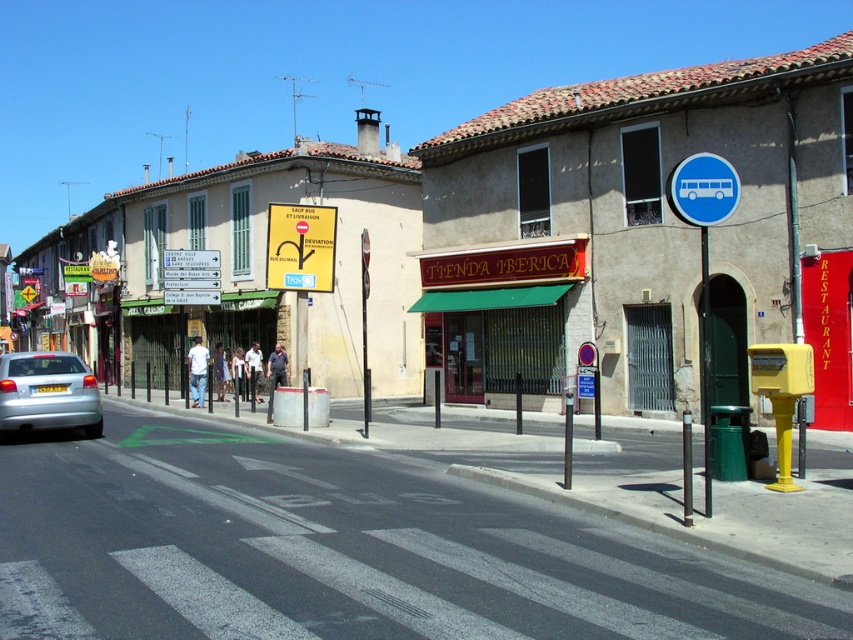
You are a tourist in this town and want to take the bus to the next village. You see the blue plastic bus at upper right and the yellow plastic sign at upper center. Which direction should you walk to reach the bus from the sign?

You should walk to the right to reach the blue plastic bus at upper right from the yellow plastic sign at upper center because the blue plastic bus at upper right is located to the right of the yellow plastic sign at upper center.

You are a delivery person carrying a large package that is 1 meter wide. You need to pass through the space between the green awning at center and the light blue denim jeans at center. Can your package fit through the space between them?

The green awning at center is wider than the light blue denim jeans at center. However, the description only provides their individual widths, not the distance between them. Without knowing the exact space between the two objects, it is impossible to determine if the package will fit.